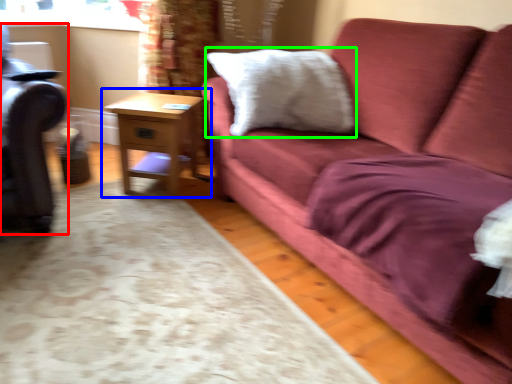
Question: Considering the real-world distances, which object is farthest from swivel chair (highlighted by a red box)? table (highlighted by a blue box) or pillow (highlighted by a green box)?

Choices:
 (A) table
 (B) pillow

Answer: (B)